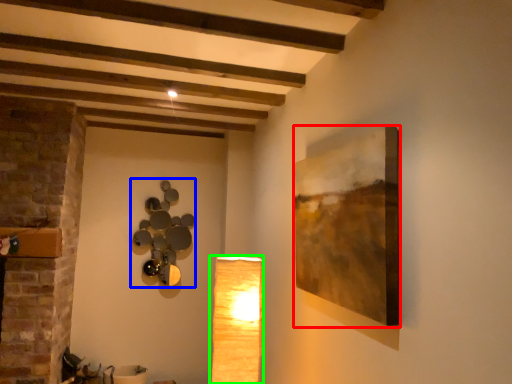
Question: Which is nearer to the picture frame (highlighted by a red box)? lamp (highlighted by a blue box) or lamp (highlighted by a green box).

Choices:
 (A) lamp
 (B) lamp

Answer: (B)